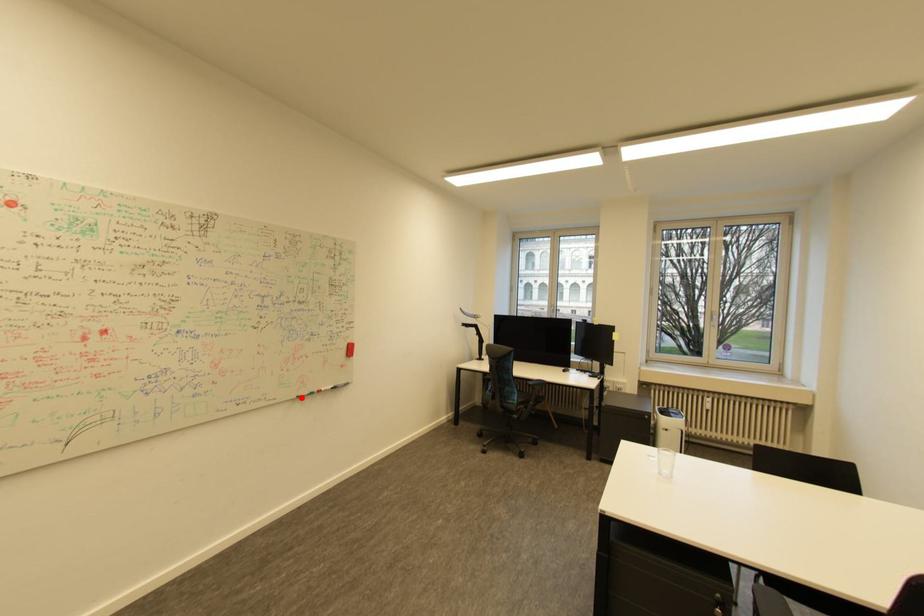
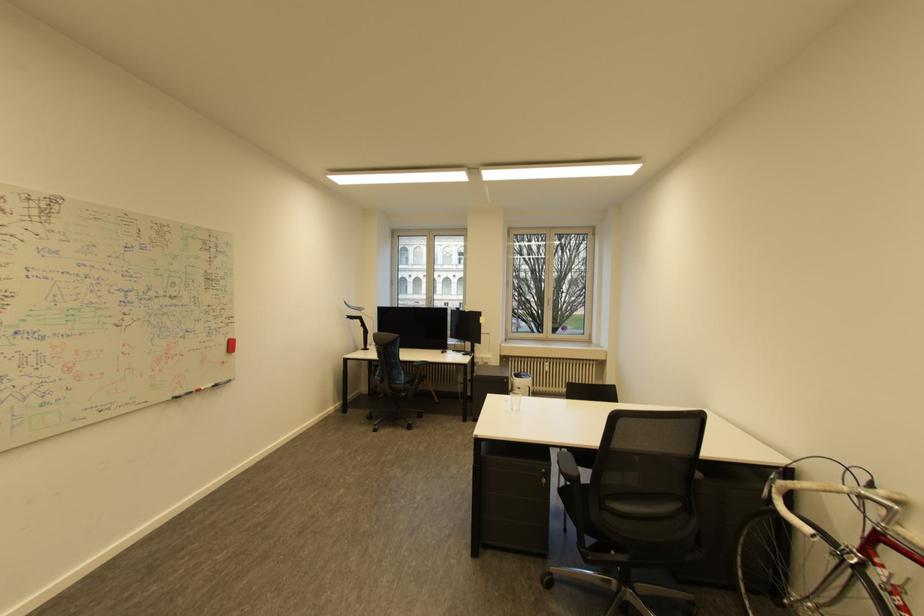
Find the pixel in the second image that matches the highlighted location in the first image.

(176, 399)